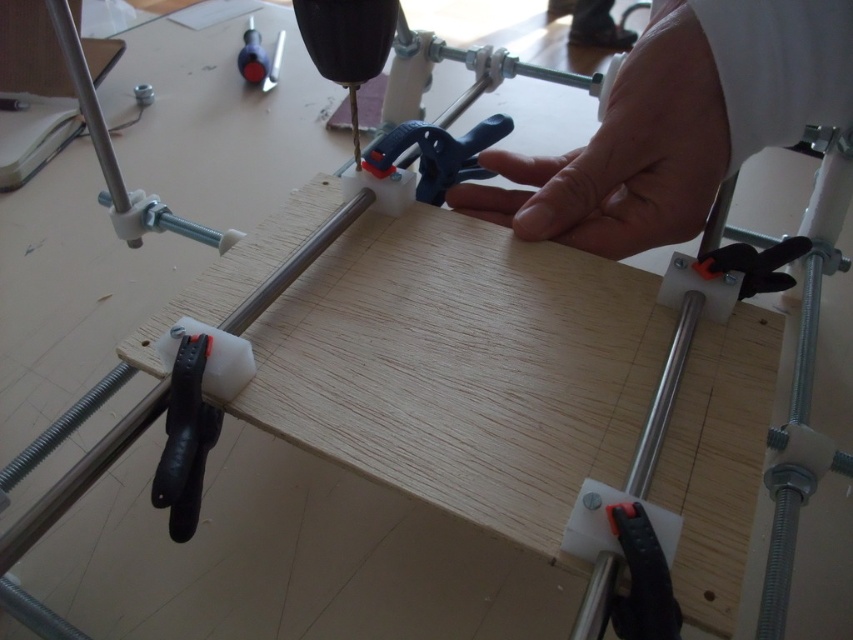
Is blue plastic clamp at center wider than matte plastic screwdriver at upper left?

Indeed, blue plastic clamp at center has a greater width compared to matte plastic screwdriver at upper left.

Does blue plastic clamp at center appear under matte plastic screwdriver at upper left?

Yes.

Is point (433, 200) in front of point (257, 54)?

That is True.

Find the location of a particular element. blue plastic clamp at center is located at coordinates (436, 154).

Is point (498, 196) farther from camera compared to point (461, 157)?

No, (498, 196) is in front of (461, 157).

Is skinny white hand at center taller than blue plastic clamp at center?

Indeed, skinny white hand at center has a greater height compared to blue plastic clamp at center.

Describe the element at coordinates (625, 156) in the screenshot. I see `skinny white hand at center` at that location.

This screenshot has height=640, width=853. I want to click on skinny white hand at center, so click(x=625, y=156).

Is skinny white hand at center positioned in front of matte plastic screwdriver at upper left?

Yes, it is in front of matte plastic screwdriver at upper left.

Can you confirm if skinny white hand at center is positioned below matte plastic screwdriver at upper left?

Correct, skinny white hand at center is located below matte plastic screwdriver at upper left.

You are a GUI agent. You are given a task and a screenshot of the screen. Output one action in this format:
    pyautogui.click(x=<x>, y=<y>)
    Task: Click on the skinny white hand at center
    
    Given the screenshot: What is the action you would take?
    pyautogui.click(x=625, y=156)